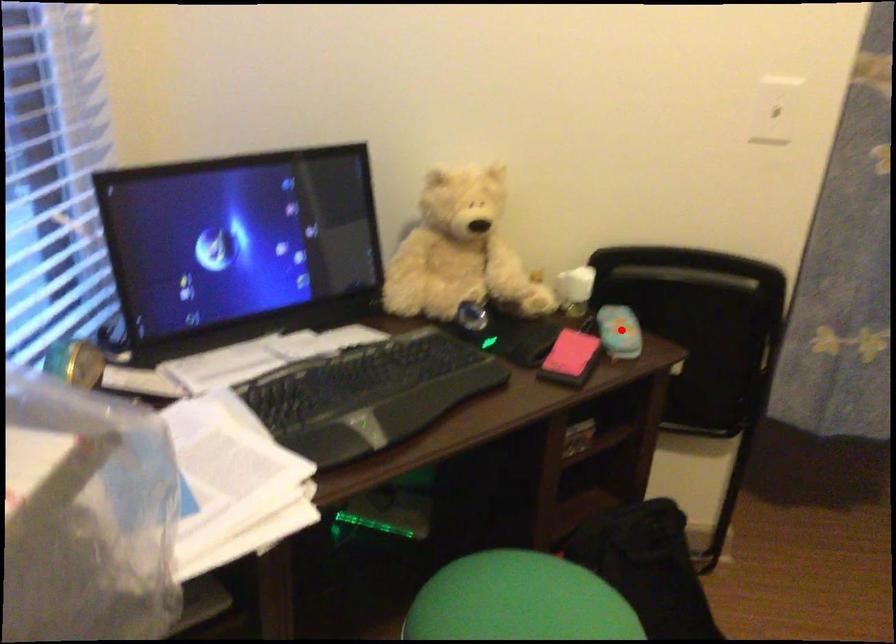
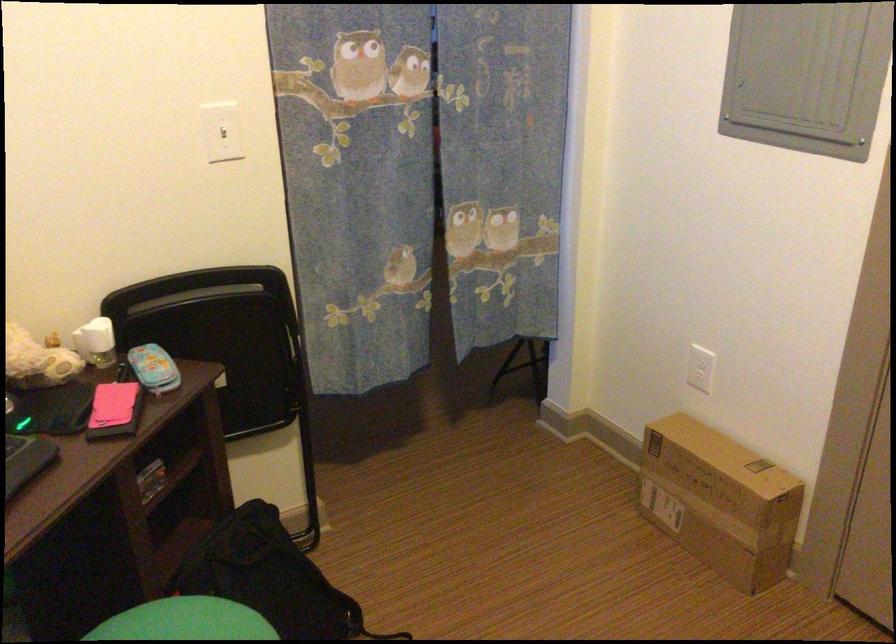
Question: I am providing you with two images of the same scene from different viewpoints. A red point is marked on the first image. Is the red point's position out of view in image 2?

Choices:
 (A) Yes
 (B) No

Answer: (B)